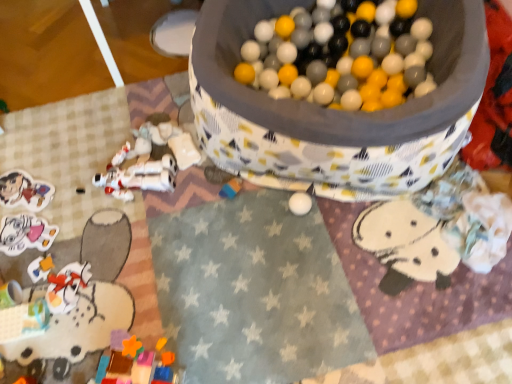
Locate an element on the screen. This screenshot has height=384, width=512. free location in front of fluffy white blanket at lower right, arranged as the 1th toy when viewed from the right is located at coordinates (462, 317).